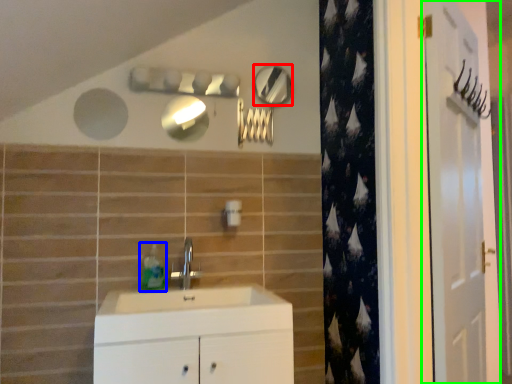
Question: Estimate the real-world distances between objects in this image. Which object is farther from mirror (highlighted by a red box), soap dispenser (highlighted by a blue box) or door (highlighted by a green box)?

Choices:
 (A) soap dispenser
 (B) door

Answer: (B)